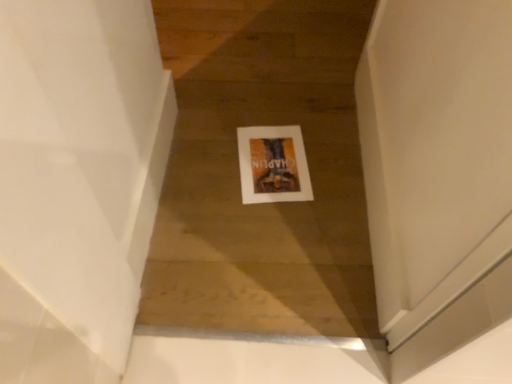
Locate an element on the screen. The height and width of the screenshot is (384, 512). free spot to the left of white matte picture frame at center is located at coordinates (200, 157).